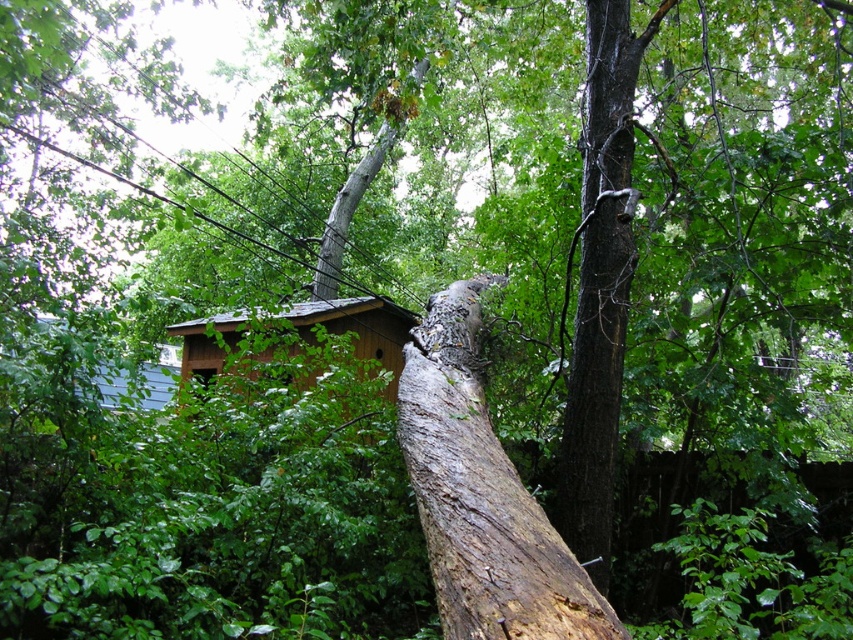
You are a hiker trying to reach the brown wooden hut at center. You see the brown rough bark at center blocking your path. Can you walk around it on either side?

The brown rough bark at center might be wider than brown wooden hut at center, so it is uncertain if there is enough space to walk around it on either side. Proceed with caution.

You are navigating through the forest and need to reach the small wooden structure with a sloped roof. There is a brown rough tree trunk at center blocking your path. Can you walk around it on either side?

The brown rough tree trunk at center is located at point [482,496], so yes, you can walk around it on either side since it is a single trunk and not an impenetrable barrier.